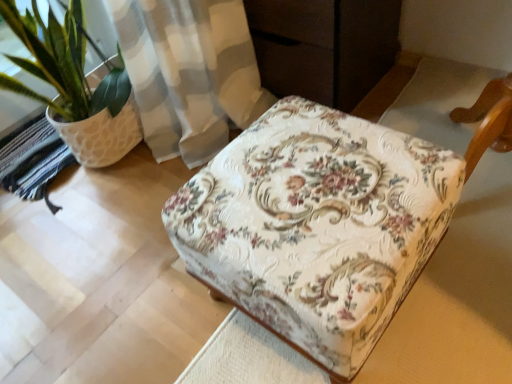
Question: In terms of size, does green leafy plant in textured pot at left appear bigger or smaller than floral fabric ottoman at center?

Choices:
 (A) big
 (B) small

Answer: (A)

Question: Which is correct: green leafy plant in textured pot at left is inside floral fabric ottoman at center, or outside of it?

Choices:
 (A) outside
 (B) inside

Answer: (A)

Question: From a real-world perspective, is green leafy plant in textured pot at left physically located above or below floral fabric ottoman at center?

Choices:
 (A) above
 (B) below

Answer: (A)

Question: Is point (310, 264) positioned closer to the camera than point (73, 64)?

Choices:
 (A) farther
 (B) closer

Answer: (B)

Question: From the image's perspective, is floral fabric ottoman at center above or below green leafy plant in textured pot at left?

Choices:
 (A) above
 (B) below

Answer: (B)

Question: Considering the positions of floral fabric ottoman at center and green leafy plant in textured pot at left in the image, is floral fabric ottoman at center taller or shorter than green leafy plant in textured pot at left?

Choices:
 (A) tall
 (B) short

Answer: (B)

Question: Looking at their shapes, would you say floral fabric ottoman at center is wider or thinner than green leafy plant in textured pot at left?

Choices:
 (A) wide
 (B) thin

Answer: (A)